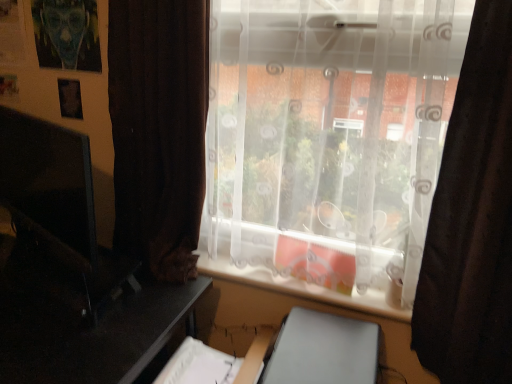
Question: Should I look upward or downward to see black glossy table at left?

Choices:
 (A) up
 (B) down

Answer: (B)

Question: Does matte black monitor at left turn towards brown fabric curtain at right?

Choices:
 (A) no
 (B) yes

Answer: (A)

Question: Is matte black monitor at left wider than brown fabric curtain at right?

Choices:
 (A) no
 (B) yes

Answer: (A)

Question: Are matte black monitor at left and brown fabric curtain at right far apart?

Choices:
 (A) yes
 (B) no

Answer: (A)

Question: Is brown fabric curtain at right completely or partially inside matte black monitor at left?

Choices:
 (A) no
 (B) yes

Answer: (A)

Question: Is matte black monitor at left facing away from brown fabric curtain at right?

Choices:
 (A) no
 (B) yes

Answer: (A)

Question: Considering the relative sizes of matte black monitor at left and brown fabric curtain at right in the image provided, is matte black monitor at left smaller than brown fabric curtain at right?

Choices:
 (A) yes
 (B) no

Answer: (A)

Question: Can you confirm if transparent fabric at center is thinner than black glossy table at left?

Choices:
 (A) yes
 (B) no

Answer: (A)

Question: Is transparent fabric at center not near black glossy table at left?

Choices:
 (A) yes
 (B) no

Answer: (B)

Question: From the image's perspective, is transparent fabric at center over black glossy table at left?

Choices:
 (A) yes
 (B) no

Answer: (A)

Question: Is transparent fabric at center wider than black glossy table at left?

Choices:
 (A) yes
 (B) no

Answer: (B)

Question: Can you confirm if transparent fabric at center is bigger than black glossy table at left?

Choices:
 (A) yes
 (B) no

Answer: (B)

Question: Is transparent fabric at center looking in the opposite direction of black glossy table at left?

Choices:
 (A) no
 (B) yes

Answer: (A)

Question: Is matte black monitor at left closer to the viewer compared to transparent fabric at center?

Choices:
 (A) yes
 (B) no

Answer: (B)